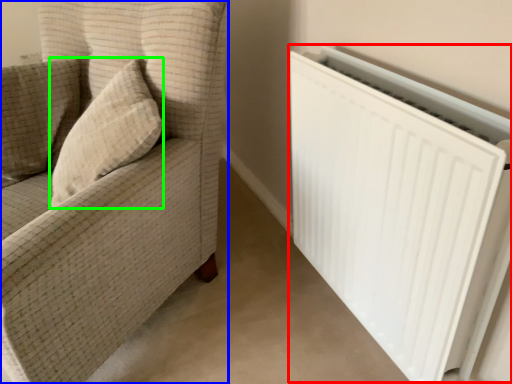
Question: Estimate the real-world distances between objects in this image. Which object is closer to radiator (highlighted by a red box), furniture (highlighted by a blue box) or throw pillow (highlighted by a green box)?

Choices:
 (A) furniture
 (B) throw pillow

Answer: (A)